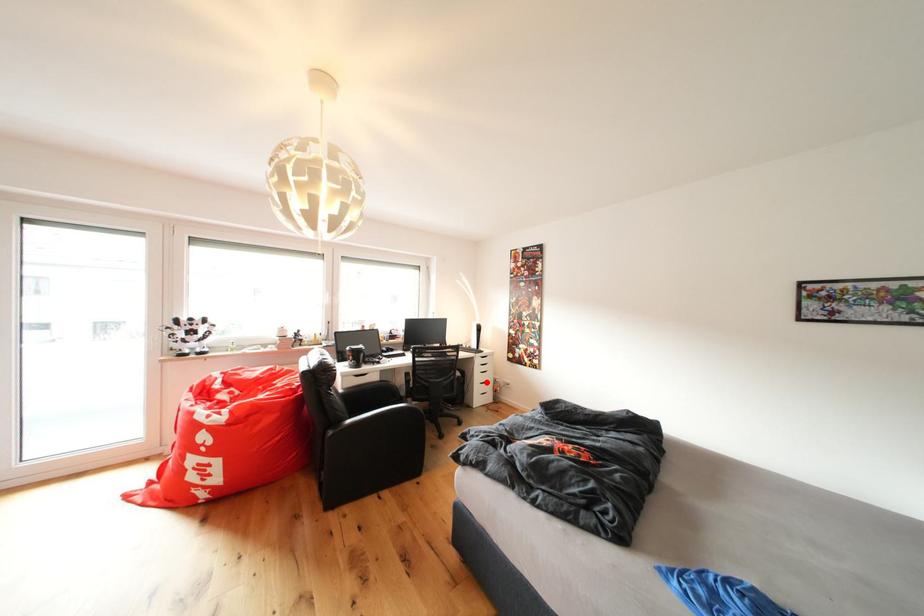
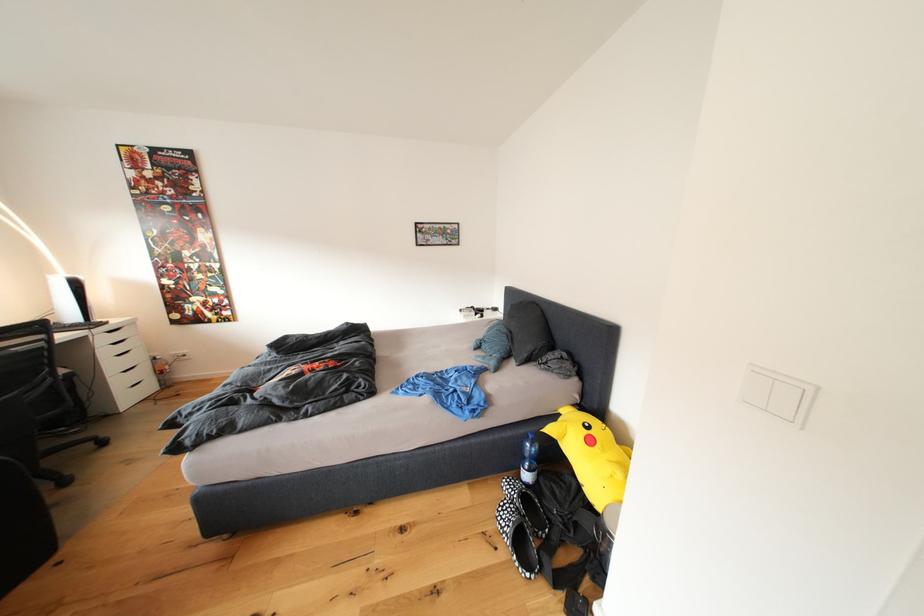
Where in the second image is the point corresponding to the highlighted location from the first image?

(120, 370)